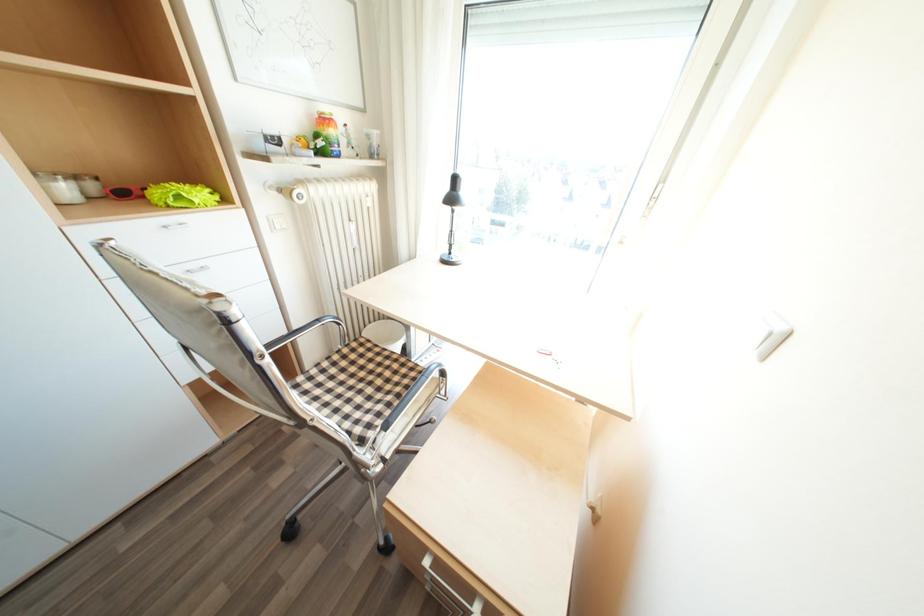
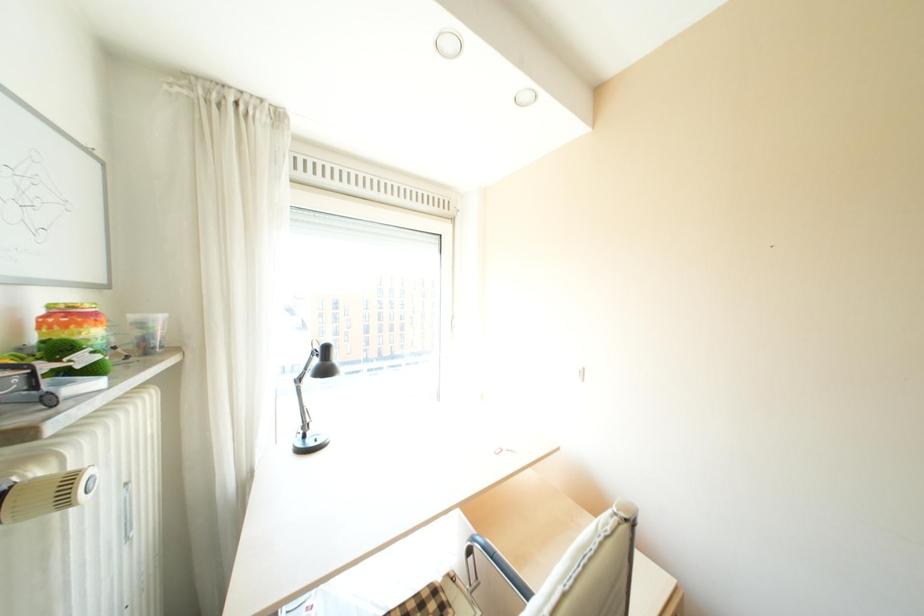
Question: The camera is either moving clockwise (left) or counter-clockwise (right) around the object. The first image is from the beginning of the video and the second image is from the end. Is the camera moving left or right when shooting the video?

Choices:
 (A) Left
 (B) Right

Answer: (A)